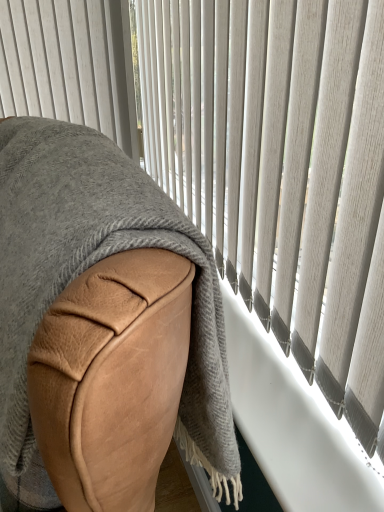
Find the location of a particular element. This screenshot has width=384, height=512. leather chair at center is located at coordinates (103, 327).

What do you see at coordinates (103, 327) in the screenshot? This screenshot has width=384, height=512. I see `leather chair at center` at bounding box center [103, 327].

Locate an element on the screen. leather chair at center is located at coordinates (103, 327).